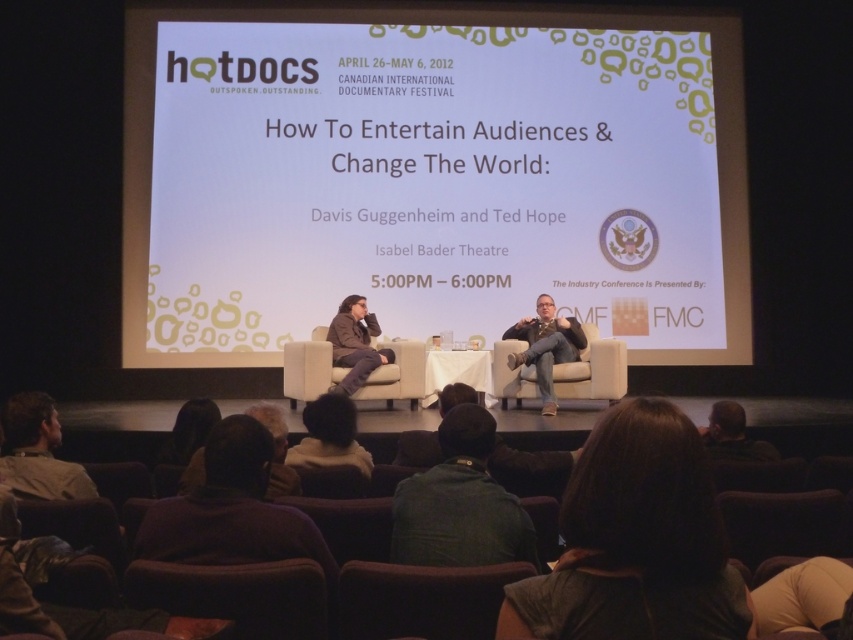
Question: Which point is farther to the camera?

Choices:
 (A) dark brown hair at lower right
 (B) dark brown leather jacket at lower center
 (C) light brown leather jacket at lower left
 (D) white fabric couch at center

Answer: (D)

Question: Can you confirm if brown fabric chair at lower center is positioned to the left of dark brown hair at lower right?

Choices:
 (A) yes
 (B) no

Answer: (A)

Question: From the image, what is the correct spatial relationship of beige fabric chair at center in relation to matte brown hair at center?

Choices:
 (A) above
 (B) below

Answer: (B)

Question: Can you confirm if white fabric couch at center is thinner than dark brown hair at lower right?

Choices:
 (A) no
 (B) yes

Answer: (A)

Question: Which object is closer to the camera taking this photo?

Choices:
 (A) matte brown hair at center
 (B) matte gray suit at center
 (C) beige fabric chair at center

Answer: (A)

Question: Considering the real-world distances, which object is closest to the dark brown hair at lower right?

Choices:
 (A) matte gray suit at center
 (B) dark green jacket at lower center

Answer: (B)